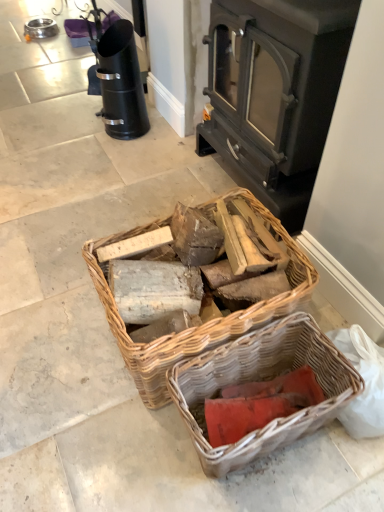
Identify the location of free space to the left of red cardboard at lower center. (168, 445).